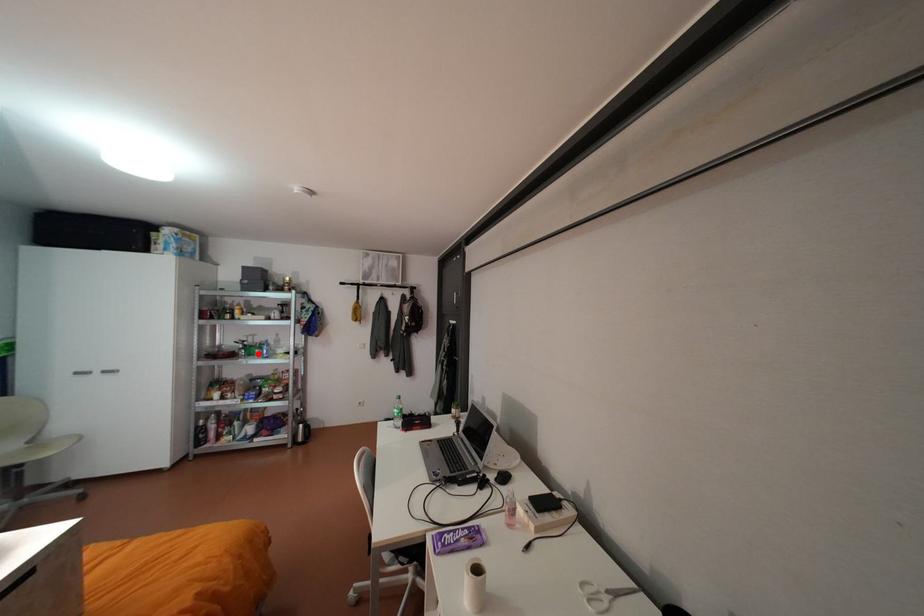
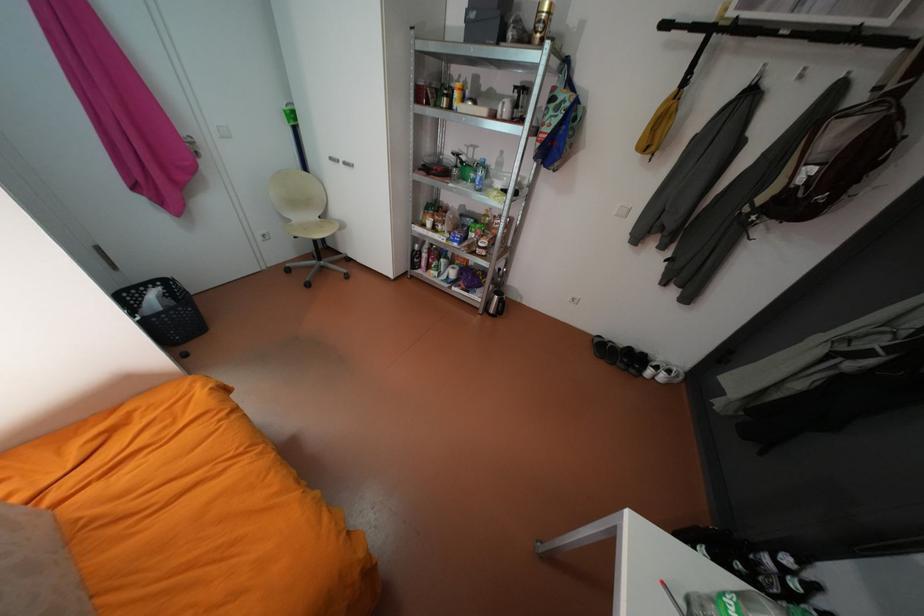
Locate, in the second image, the point that corresponds to the highlighted location in the first image.

(471, 177)